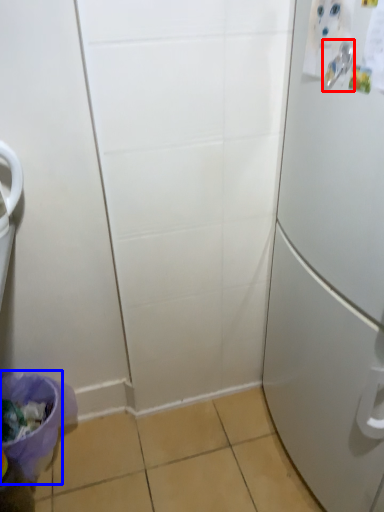
Question: Which of the following is the closest to the observer, door handle (highlighted by a red box) or potty (highlighted by a blue box)?

Choices:
 (A) door handle
 (B) potty

Answer: (A)